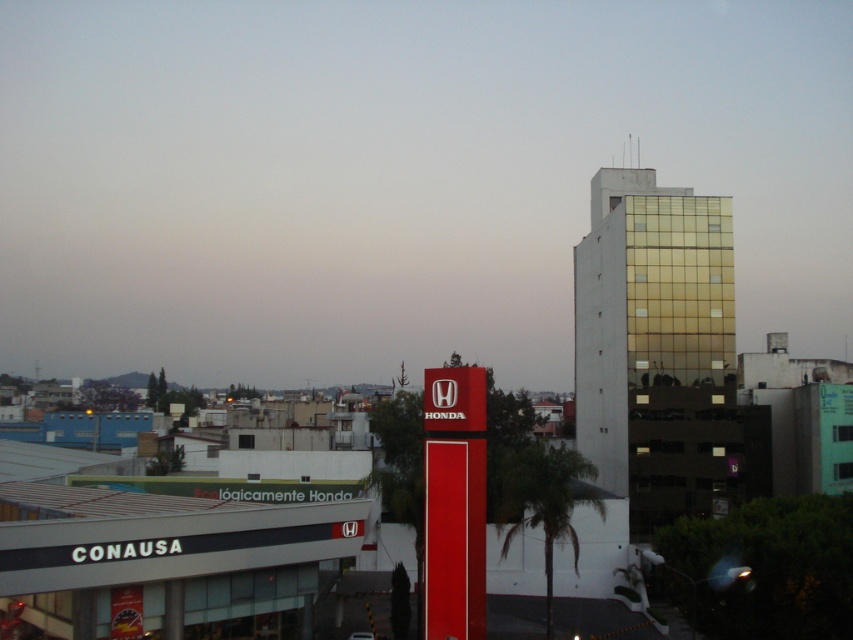
You are a city planner who wants to install a new streetlight between the gold glass building at center and the green leafy palm tree at center. The streetlight requires a minimum of 15 meters of space between the building and the tree to be placed. Can the streetlight be installed in this location?

The gold glass building at center is 20.79 meters from the green leafy palm tree at center. Since the required space is 15 meters, the streetlight can be installed between them as the distance is sufficient.

You are a delivery driver who needs to deliver a package to the Honda dealership. You see the red glossy sign at center and the green leafy palm tree at center in the image. Which object is closer to you?

The red glossy sign at center is closer to you because the green leafy palm tree at center is behind it.

You are standing in the middle of the street looking at the gold glass building at center and the green leafy palm tree at center. Which object is closer to you?

The gold glass building at center is closer to you because it is further to the viewer than the green leafy palm tree at center.